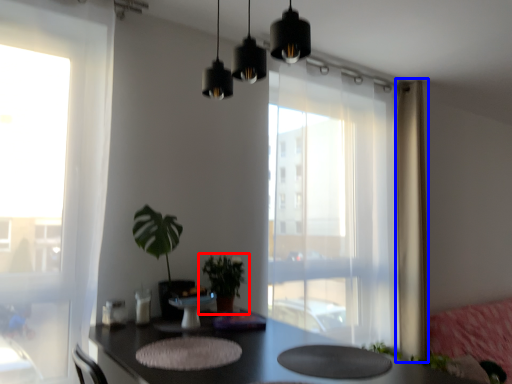
Question: Which of the following is the farthest to the observer, houseplant (highlighted by a red box) or curtain (highlighted by a blue box)?

Choices:
 (A) houseplant
 (B) curtain

Answer: (B)